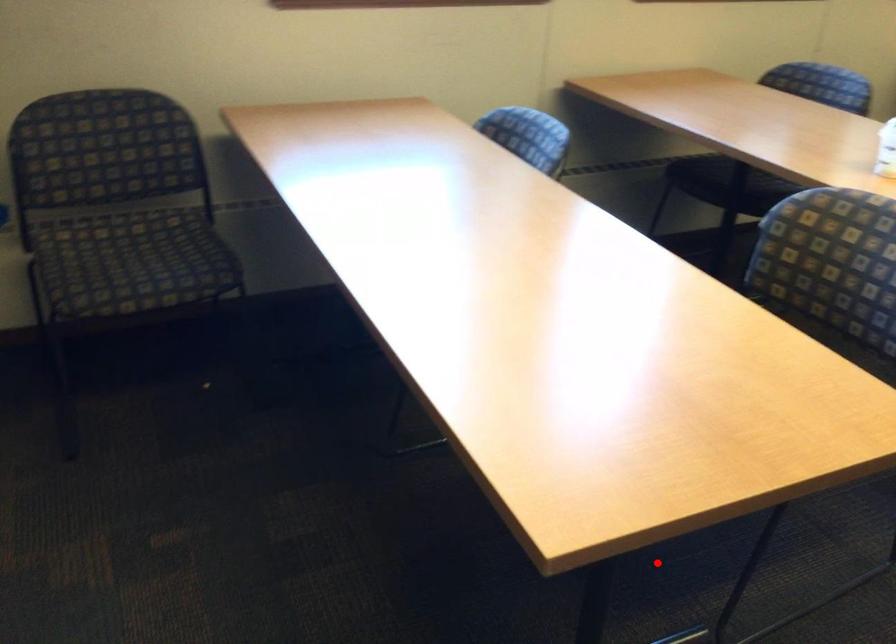
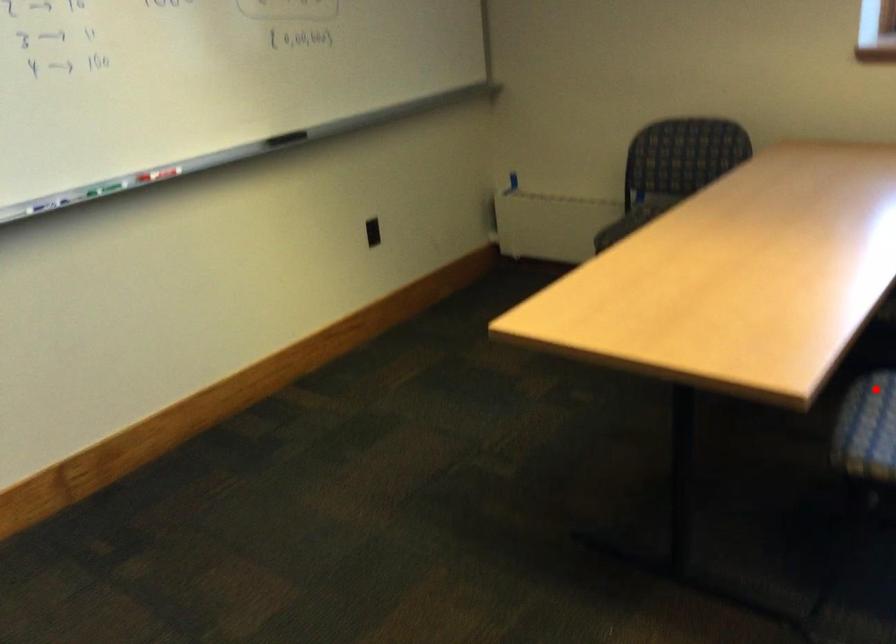
I am providing you with two images of the same scene from different viewpoints. A red point is marked on the first image and another point is marked on the second image. Does the point marked in image1 correspond to the same location as the one in image2?

No